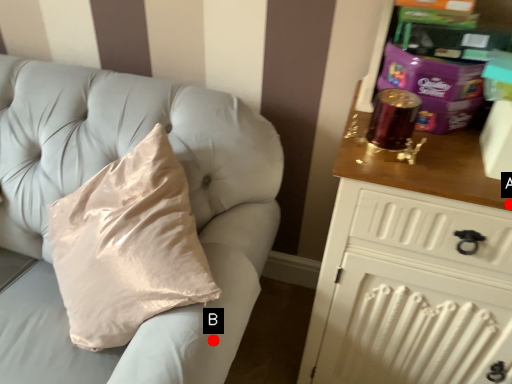
Question: Two points are circled on the image, labeled by A and B beside each circle. Which point appears farthest from the camera in this image?

Choices:
 (A) A is further
 (B) B is further

Answer: (B)